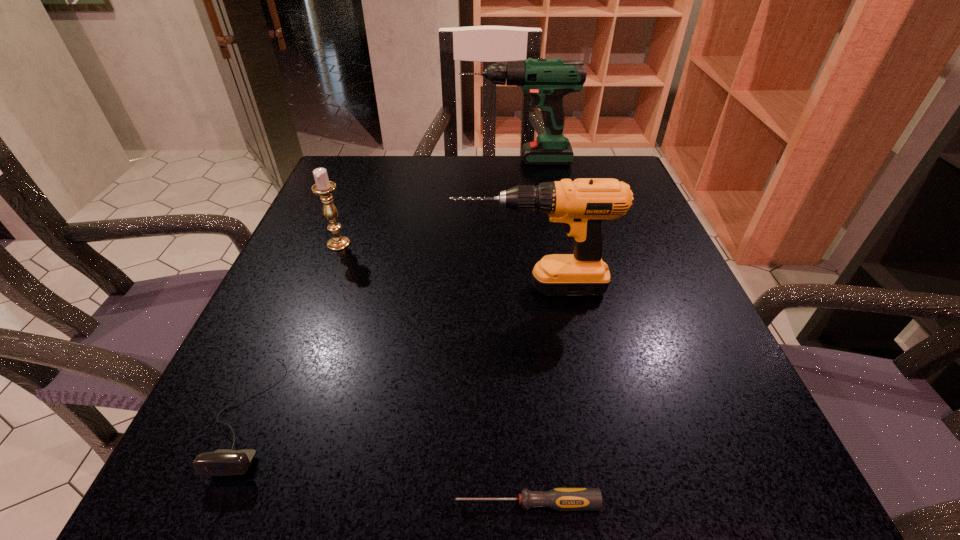
The image size is (960, 540). In order to click on vacant space located on the handle side of the farthest object in this screenshot , I will do `click(356, 160)`.

Locate an element on the screen. free region located at the tip of the third nearest object is located at coordinates (312, 287).

Locate an element on the screen. free space located at the tip of the third nearest object is located at coordinates (415, 287).

I want to click on vacant space located at the tip of the third nearest object, so click(x=324, y=287).

Find the location of `free space located 0.190m on the front of the third shortest object`. free space located 0.190m on the front of the third shortest object is located at coordinates (307, 325).

The height and width of the screenshot is (540, 960). Find the location of `free spot located insert the nearest object into a screw head`. free spot located insert the nearest object into a screw head is located at coordinates (300, 503).

What are the coordinates of `vacant position located 0.280m insert the nearest object into a screw head` in the screenshot? It's located at (213, 503).

Locate an element on the screen. Image resolution: width=960 pixels, height=540 pixels. free spot located 0.220m insert the nearest object into a screw head is located at coordinates (265, 503).

You are a GUI agent. You are given a task and a screenshot of the screen. Output one action in this format:
    pyautogui.click(x=<x>, y=<y>)
    Task: Click on the object at the far edge
    The height and width of the screenshot is (540, 960).
    Given the screenshot: What is the action you would take?
    pyautogui.click(x=547, y=80)

Locate an element on the screen. webcam positioned at the near edge is located at coordinates tap(224, 462).